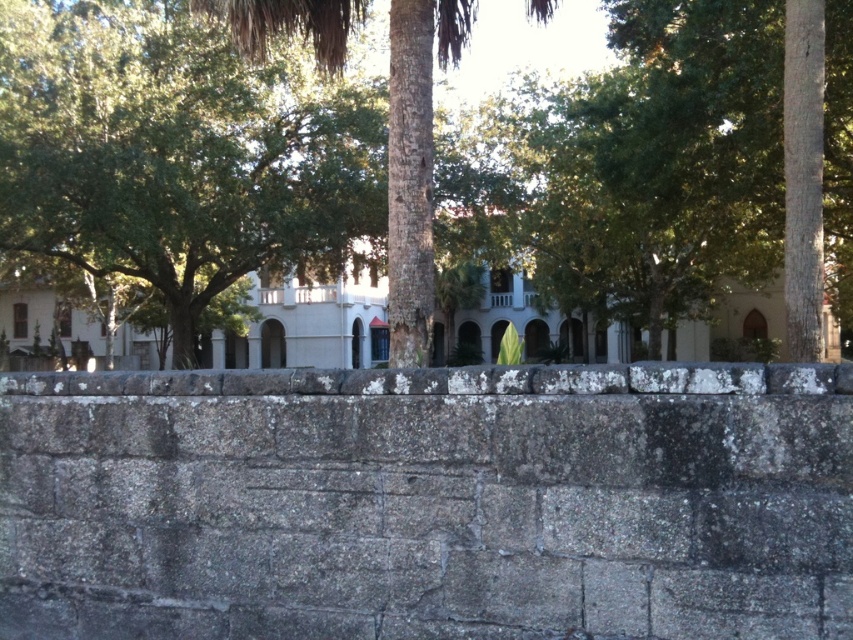
Between point (813, 218) and point (399, 312), which one is positioned in front?

Point (813, 218)

Locate an element on the screen. green leafy tree at center is located at coordinates (175, 150).

Which is behind, point (93, 4) or point (335, 51)?

The point (93, 4) is behind.

You are a GUI agent. You are given a task and a screenshot of the screen. Output one action in this format:
    pyautogui.click(x=<x>, y=<y>)
    Task: Click on the green leafy tree at center
    Image resolution: width=853 pixels, height=640 pixels.
    Given the screenshot: What is the action you would take?
    pyautogui.click(x=175, y=150)